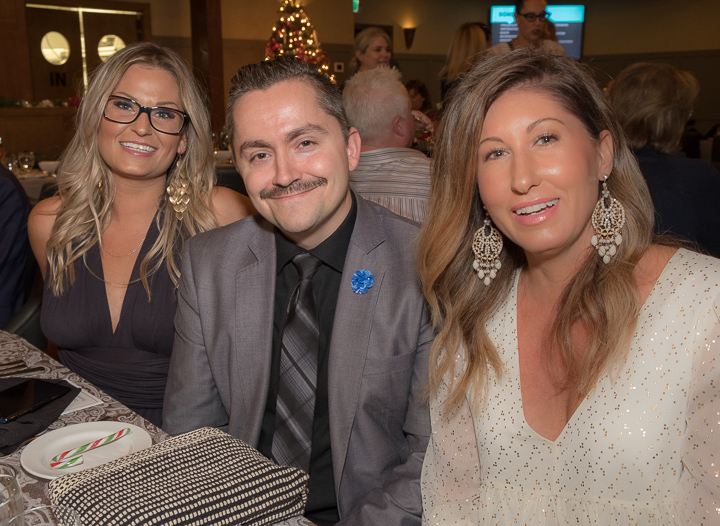
This screenshot has width=720, height=526. Identify the location of christmas tree. (294, 36).